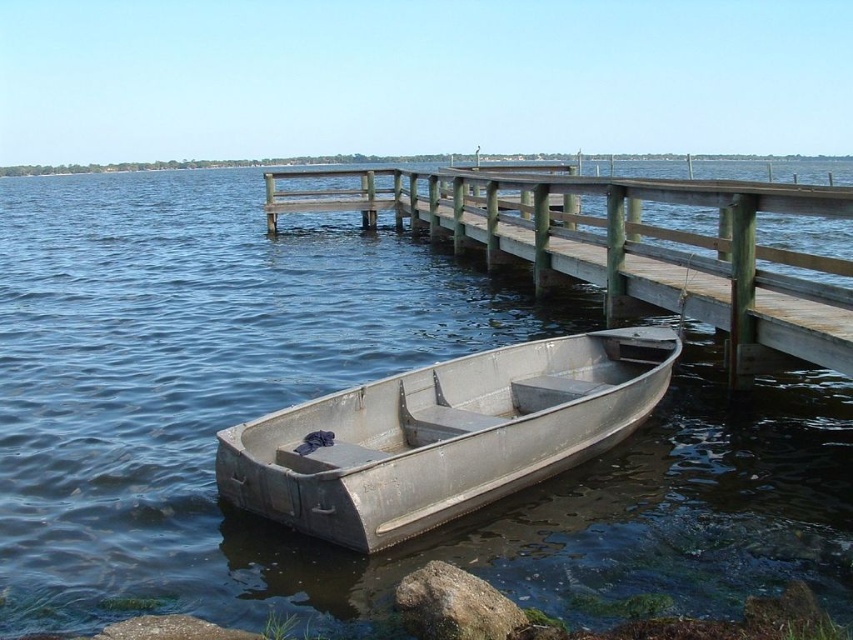
Who is taller, metallic water at center or metallic gray boat at lower left?

Standing taller between the two is metallic water at center.

Looking at this image, does metallic water at center have a larger size compared to metallic gray boat at lower left?

Yes.

The width and height of the screenshot is (853, 640). I want to click on metallic water at center, so click(x=337, y=388).

The image size is (853, 640). I want to click on metallic water at center, so click(337, 388).

Is point (431, 392) behind point (849, 308)?

Yes.

From the picture: Can you confirm if metallic gray boat at lower left is shorter than green wood rail at center?

Correct, metallic gray boat at lower left is not as tall as green wood rail at center.

Is point (292, 413) behind point (486, 195)?

That is False.

At what (x,y) coordinates should I click in order to perform the action: click on metallic gray boat at lower left. Please return your answer as a coordinate pair (x, y). The image size is (853, 640). Looking at the image, I should click on (444, 435).

Looking at this image, does metallic water at center appear under green wood rail at center?

Incorrect, metallic water at center is not positioned below green wood rail at center.

Locate an element on the screen. metallic water at center is located at coordinates (337, 388).

Who is more distant from viewer, (618, 532) or (735, 340)?

Point (735, 340)

I want to click on metallic water at center, so click(x=337, y=388).